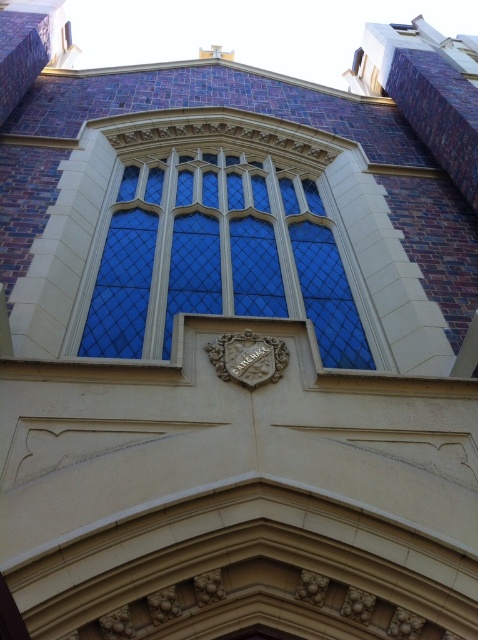
Looking at this image, is blue glass window at center behind stone carved crest at center?

Yes, it is.

Does blue glass window at center appear under stone carved crest at center?

No, blue glass window at center is not below stone carved crest at center.

Is point (254, 268) less distant than point (249, 339)?

No, it is behind (249, 339).

Locate an element on the screen. blue glass window at center is located at coordinates (214, 257).